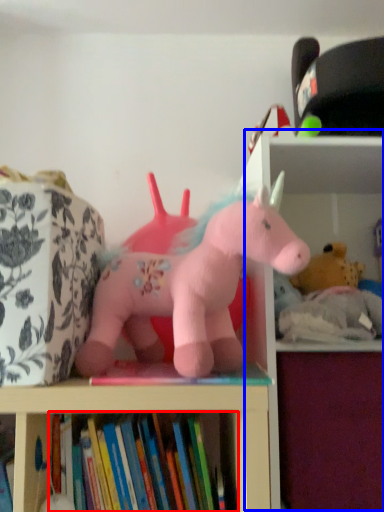
Question: Which of the following is the farthest to the observer, book (highlighted by a red box) or bookshelf (highlighted by a blue box)?

Choices:
 (A) book
 (B) bookshelf

Answer: (B)